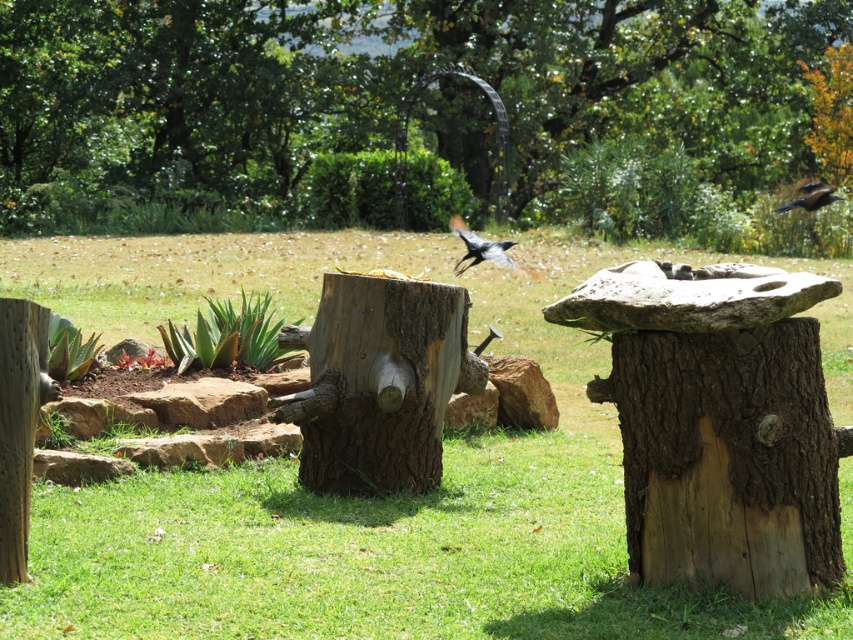
You are standing in the garden scene and want to place a small decorative item between the two points labeled point (228, 202) and point (752, 570). Which point should you start from to ensure the item is closer to the camera?

You should start from point (228, 202) because it is closer to the camera than point (752, 570).